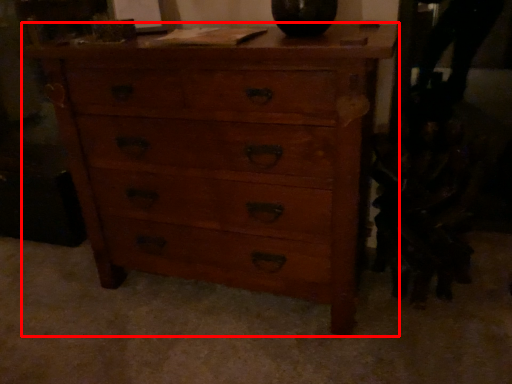
Question: Where is chest of drawers (annotated by the red box) located in relation to swivel chair in the image?

Choices:
 (A) left
 (B) right

Answer: (A)